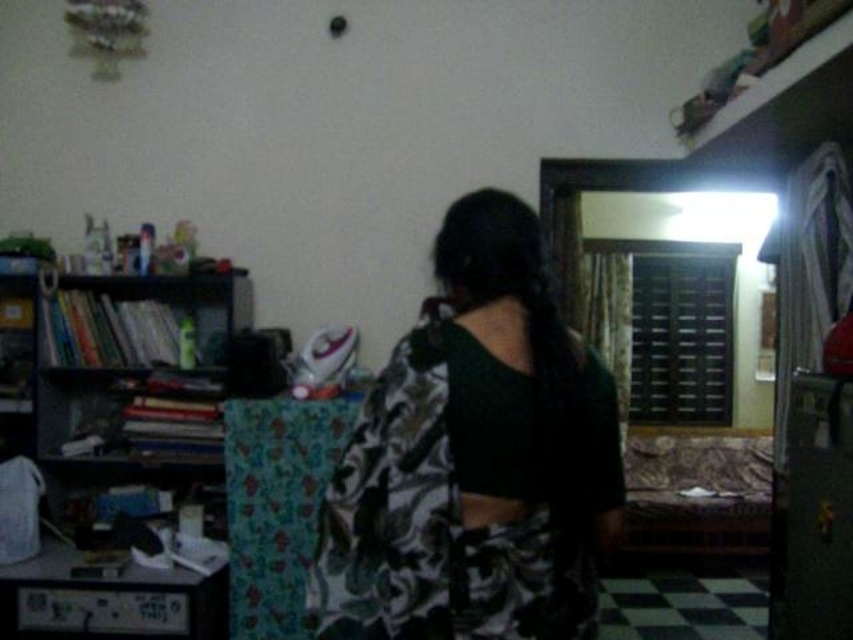
Question: Is printed fabric dress at center bigger than black matte bookshelf at left?

Choices:
 (A) yes
 (B) no

Answer: (B)

Question: Can you confirm if printed fabric dress at center is thinner than black matte bookshelf at left?

Choices:
 (A) yes
 (B) no

Answer: (A)

Question: Can you confirm if printed fabric dress at center is positioned below black matte bookshelf at left?

Choices:
 (A) yes
 (B) no

Answer: (A)

Question: Which object appears closest to the camera in this image?

Choices:
 (A) printed fabric dress at center
 (B) black matte bookshelf at left

Answer: (A)

Question: Which of the following is the farthest from the observer?

Choices:
 (A) black matte bookshelf at left
 (B) printed fabric dress at center

Answer: (A)